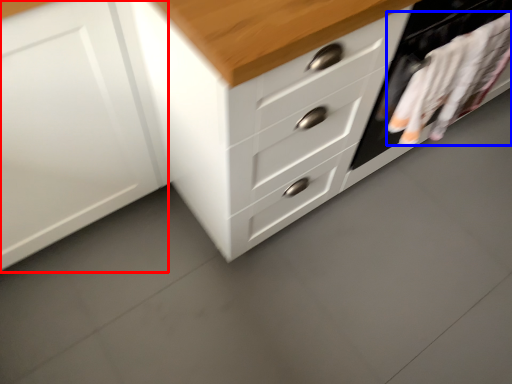
Question: Among these objects, which one is nearest to the camera, cabinetry (highlighted by a red box) or laundry (highlighted by a blue box)?

Choices:
 (A) cabinetry
 (B) laundry

Answer: (A)